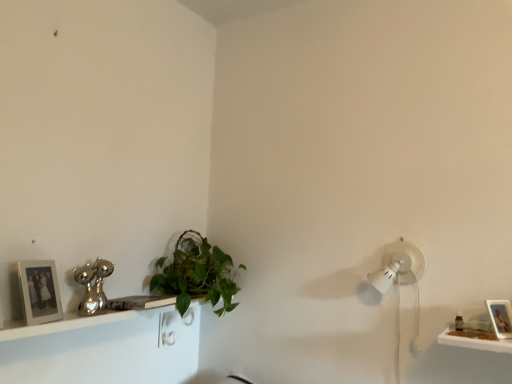
Describe the element at coordinates (501, 317) in the screenshot. I see `wooden photo frame at lower right, which is counted as the 1th picture frame, starting from the right` at that location.

You are a GUI agent. You are given a task and a screenshot of the screen. Output one action in this format:
    pyautogui.click(x=<x>, y=<y>)
    Task: Click on the white matte picture frame at left, which ranks as the 1th picture frame in left-to-right order
    The width and height of the screenshot is (512, 384).
    Given the screenshot: What is the action you would take?
    pyautogui.click(x=39, y=291)

Where is `white glossy shelf at lower left`? white glossy shelf at lower left is located at coordinates (104, 348).

From the image's perspective, which one is positioned lower, white matte picture frame at left, which is the 2th picture frame from right to left, or wooden photo frame at lower right, which is counted as the 1th picture frame, starting from the right?

wooden photo frame at lower right, which is counted as the 1th picture frame, starting from the right, from the image's perspective.

Is wooden photo frame at lower right, which is counted as the 1th picture frame, starting from the right, surrounded by white matte picture frame at left, which is the 2th picture frame from right to left?

No, wooden photo frame at lower right, which is counted as the 1th picture frame, starting from the right, is located outside of white matte picture frame at left, which is the 2th picture frame from right to left.

Who is more distant, white matte picture frame at left, which ranks as the 1th picture frame in left-to-right order, or wooden photo frame at lower right, the second picture frame in the left-to-right sequence?

Positioned behind is wooden photo frame at lower right, the second picture frame in the left-to-right sequence.

Between green leafy plant at center and white glossy shelf at lower left, which one has less height?

white glossy shelf at lower left is shorter.

Which object is thinner, green leafy plant at center or white glossy shelf at lower left?

With smaller width is white glossy shelf at lower left.

Who is bigger, green leafy plant at center or white glossy shelf at lower left?

green leafy plant at center is bigger.

Between white glossy shelf at lower left and green leafy plant at center, which one has larger size?

green leafy plant at center is bigger.

Considering the relative positions of white glossy shelf at lower left and green leafy plant at center in the image provided, is white glossy shelf at lower left behind green leafy plant at center?

No.

Does white glossy shelf at lower left have a lesser height compared to green leafy plant at center?

Yes, white glossy shelf at lower left is shorter than green leafy plant at center.

From a real-world perspective, is white matte picture frame at left, which ranks as the 1th picture frame in left-to-right order, physically below green leafy plant at center?

Correct, in the physical world, white matte picture frame at left, which ranks as the 1th picture frame in left-to-right order, is lower than green leafy plant at center.

Which is behind, white matte picture frame at left, which is the 2th picture frame from right to left, or green leafy plant at center?

green leafy plant at center is more distant.

Which object is positioned more to the left, white matte picture frame at left, which is the 2th picture frame from right to left, or green leafy plant at center?

white matte picture frame at left, which is the 2th picture frame from right to left, is more to the left.

Are wooden photo frame at lower right, the second picture frame in the left-to-right sequence, and green leafy plant at center beside each other?

There is a gap between wooden photo frame at lower right, the second picture frame in the left-to-right sequence, and green leafy plant at center.

Is wooden photo frame at lower right, the second picture frame in the left-to-right sequence, oriented away from green leafy plant at center?

No, green leafy plant at center is not at the back of wooden photo frame at lower right, the second picture frame in the left-to-right sequence.

Is wooden photo frame at lower right, the second picture frame in the left-to-right sequence, closer to camera compared to green leafy plant at center?

That is True.

Between wooden photo frame at lower right, the second picture frame in the left-to-right sequence, and green leafy plant at center, which one appears on the left side from the viewer's perspective?

green leafy plant at center is more to the left.

Is point (161, 293) behind point (52, 295)?

Yes, it is behind point (52, 295).

From a real-world perspective, between green leafy plant at center and white matte picture frame at left, which ranks as the 1th picture frame in left-to-right order, who is vertically lower?

From a 3D spatial view, white matte picture frame at left, which ranks as the 1th picture frame in left-to-right order, is below.

From the image's perspective, which one is positioned lower, green leafy plant at center or white matte picture frame at left, which is the 2th picture frame from right to left?

green leafy plant at center.

Which of these two, green leafy plant at center or white matte picture frame at left, which ranks as the 1th picture frame in left-to-right order, stands shorter?

Standing shorter between the two is white matte picture frame at left, which ranks as the 1th picture frame in left-to-right order.

From a real-world perspective, which object stands above the other?

green leafy plant at center, from a real-world perspective.

Which is behind, green leafy plant at center or wooden photo frame at lower right, the second picture frame in the left-to-right sequence?

Positioned behind is green leafy plant at center.

Where is `picture frame on the right side of green leafy plant at center`? picture frame on the right side of green leafy plant at center is located at coordinates (501, 317).

Find the location of a particular element. picture frame located in front of the wooden photo frame at lower right, which is counted as the 1th picture frame, starting from the right is located at coordinates (39, 291).

Find the location of `houseplant above the white glossy shelf at lower left (from the image's perspective)`. houseplant above the white glossy shelf at lower left (from the image's perspective) is located at coordinates click(196, 274).

Based on their spatial positions, is white matte picture frame at left, which ranks as the 1th picture frame in left-to-right order, or green leafy plant at center further from white glossy shelf at lower left?

white matte picture frame at left, which ranks as the 1th picture frame in left-to-right order.

From the image, which object appears to be nearer to white glossy shelf at lower left, green leafy plant at center or wooden photo frame at lower right, the second picture frame in the left-to-right sequence?

Among the two, green leafy plant at center is located nearer to white glossy shelf at lower left.

From the image, which object appears to be farther from white matte picture frame at left, which is the 2th picture frame from right to left, white glossy shelf at lower left or wooden photo frame at lower right, the second picture frame in the left-to-right sequence?

wooden photo frame at lower right, the second picture frame in the left-to-right sequence, lies further to white matte picture frame at left, which is the 2th picture frame from right to left, than the other object.

Based on their spatial positions, is green leafy plant at center or white glossy shelf at lower left further from white matte picture frame at left, which is the 2th picture frame from right to left?

Among the two, green leafy plant at center is located further to white matte picture frame at left, which is the 2th picture frame from right to left.

From the image, which object appears to be farther from green leafy plant at center, wooden photo frame at lower right, which is counted as the 1th picture frame, starting from the right, or white matte picture frame at left, which ranks as the 1th picture frame in left-to-right order?

wooden photo frame at lower right, which is counted as the 1th picture frame, starting from the right, lies further to green leafy plant at center than the other object.

Estimate the real-world distances between objects in this image. Which object is further from wooden photo frame at lower right, which is counted as the 1th picture frame, starting from the right, white glossy shelf at lower left or green leafy plant at center?

white glossy shelf at lower left lies further to wooden photo frame at lower right, which is counted as the 1th picture frame, starting from the right, than the other object.

When comparing their distances from white glossy shelf at lower left, does wooden photo frame at lower right, which is counted as the 1th picture frame, starting from the right, or green leafy plant at center seem further?

wooden photo frame at lower right, which is counted as the 1th picture frame, starting from the right.

Considering their positions, is green leafy plant at center positioned closer to wooden photo frame at lower right, the second picture frame in the left-to-right sequence, than white matte picture frame at left, which ranks as the 1th picture frame in left-to-right order?

green leafy plant at center is closer to wooden photo frame at lower right, the second picture frame in the left-to-right sequence.

Find the location of a particular element. Image resolution: width=512 pixels, height=384 pixels. houseplant situated between white glossy shelf at lower left and wooden photo frame at lower right, the second picture frame in the left-to-right sequence, from left to right is located at coordinates (196, 274).

At what (x,y) coordinates should I click in order to perform the action: click on houseplant located between white matte picture frame at left, which is the 2th picture frame from right to left, and wooden photo frame at lower right, which is counted as the 1th picture frame, starting from the right, in the left-right direction. Please return your answer as a coordinate pair (x, y). This screenshot has height=384, width=512. Looking at the image, I should click on (196, 274).

Find the location of `shelf between white matte picture frame at left, which is the 2th picture frame from right to left, and green leafy plant at center`. shelf between white matte picture frame at left, which is the 2th picture frame from right to left, and green leafy plant at center is located at coordinates (104, 348).

Where is `shelf between white matte picture frame at left, which ranks as the 1th picture frame in left-to-right order, and wooden photo frame at lower right, the second picture frame in the left-to-right sequence, in the horizontal direction`? This screenshot has width=512, height=384. shelf between white matte picture frame at left, which ranks as the 1th picture frame in left-to-right order, and wooden photo frame at lower right, the second picture frame in the left-to-right sequence, in the horizontal direction is located at coordinates (104, 348).